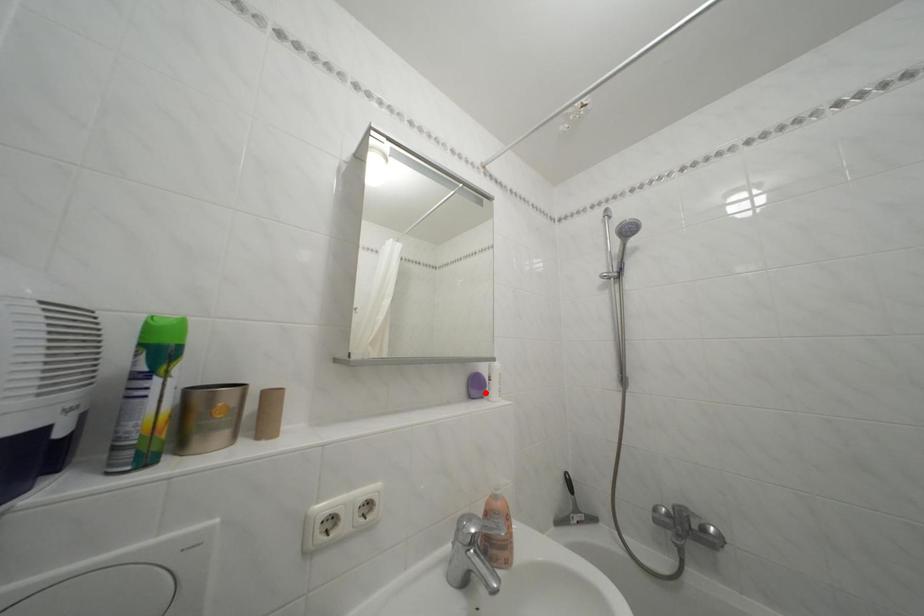
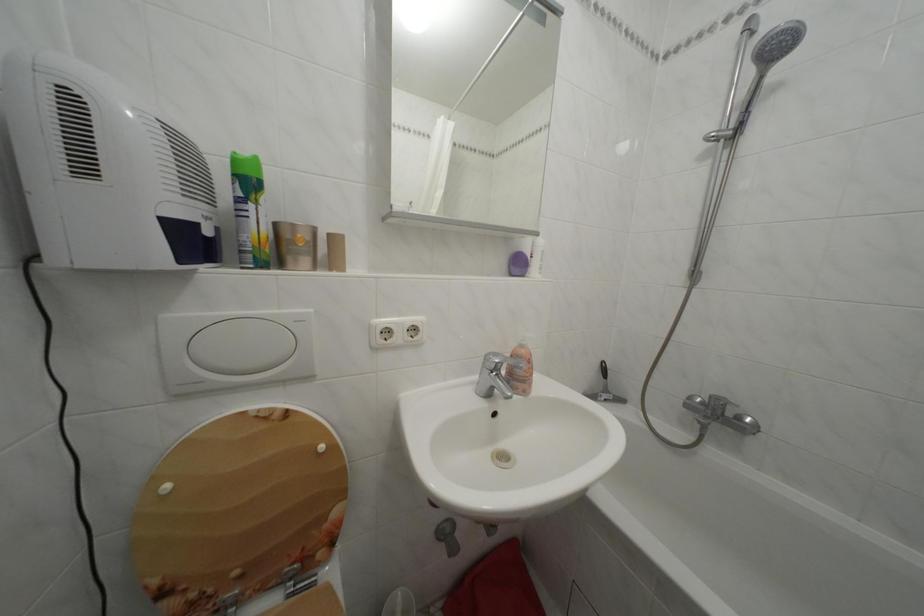
Locate, in the second image, the point that corresponds to the highlighted location in the first image.

(527, 270)